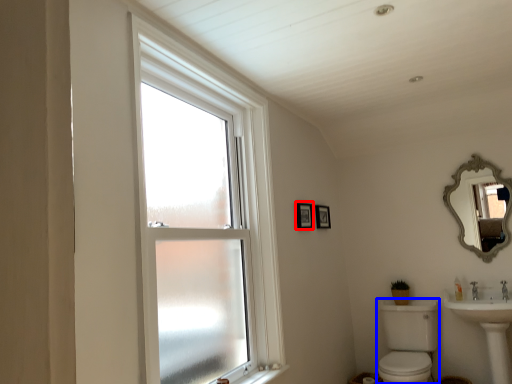
Question: Which object is further to the camera taking this photo, picture frame (highlighted by a red box) or sink (highlighted by a blue box)?

Choices:
 (A) picture frame
 (B) sink

Answer: (A)